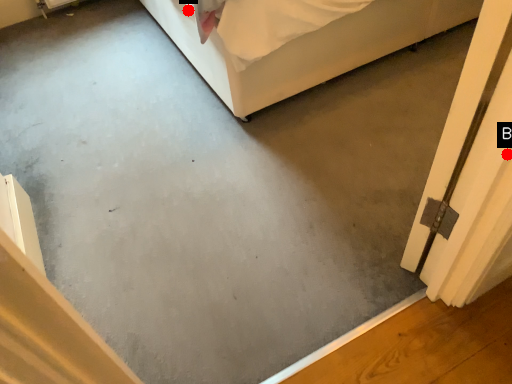
Question: Two points are circled on the image, labeled by A and B beside each circle. Which point is closer to the camera?

Choices:
 (A) A is closer
 (B) B is closer

Answer: (B)